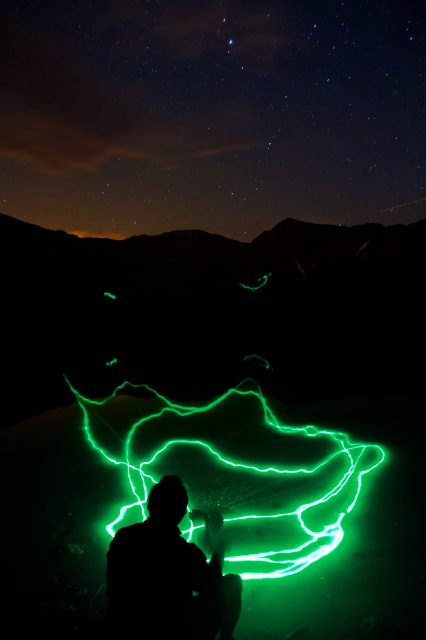
Question: Is neon green light at center above silhouette figure at center?

Choices:
 (A) no
 (B) yes

Answer: (A)

Question: Is neon green light at center behind silhouette figure at center?

Choices:
 (A) no
 (B) yes

Answer: (B)

Question: Which object is closer to the camera taking this photo?

Choices:
 (A) neon green light at center
 (B) silhouette figure at center

Answer: (B)

Question: Which object appears closest to the camera in this image?

Choices:
 (A) silhouette figure at center
 (B) neon green light at center

Answer: (A)

Question: Is neon green light at center above silhouette figure at center?

Choices:
 (A) yes
 (B) no

Answer: (B)